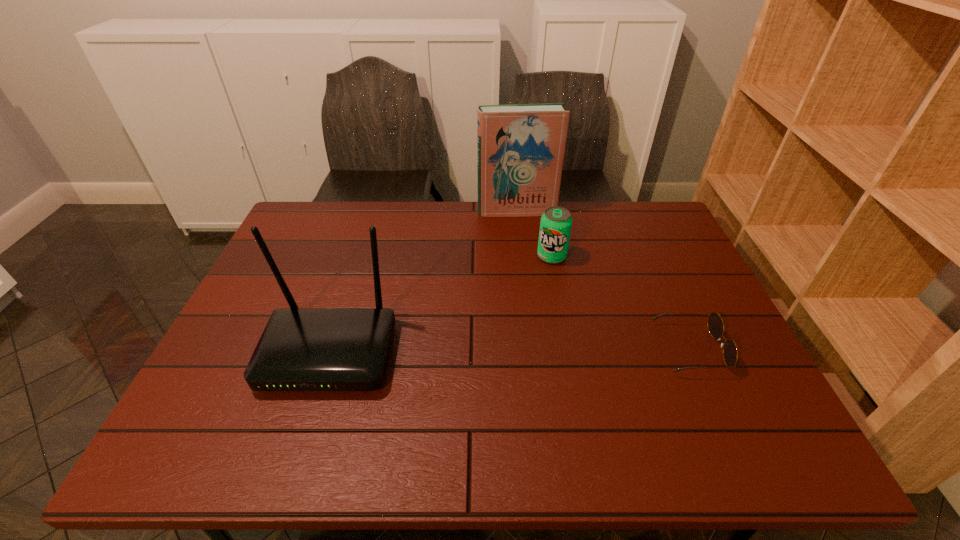
Locate an element on the screen. This screenshot has height=540, width=960. vacant spot on the desktop that is between the router and the rightmost object and is positioned on the cover of the tallest object is located at coordinates [544, 350].

Find the location of a particular element. Image resolution: width=960 pixels, height=540 pixels. vacant space on the desktop that is between the leftmost object and the sunglasses and is positioned on the front-facing side of the pop soda is located at coordinates (545, 350).